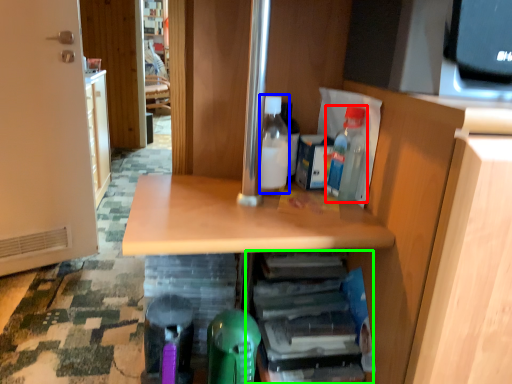
Question: Which is nearer to the bottle (highlighted by a red box)? bottle (highlighted by a blue box) or shelf (highlighted by a green box).

Choices:
 (A) bottle
 (B) shelf

Answer: (A)